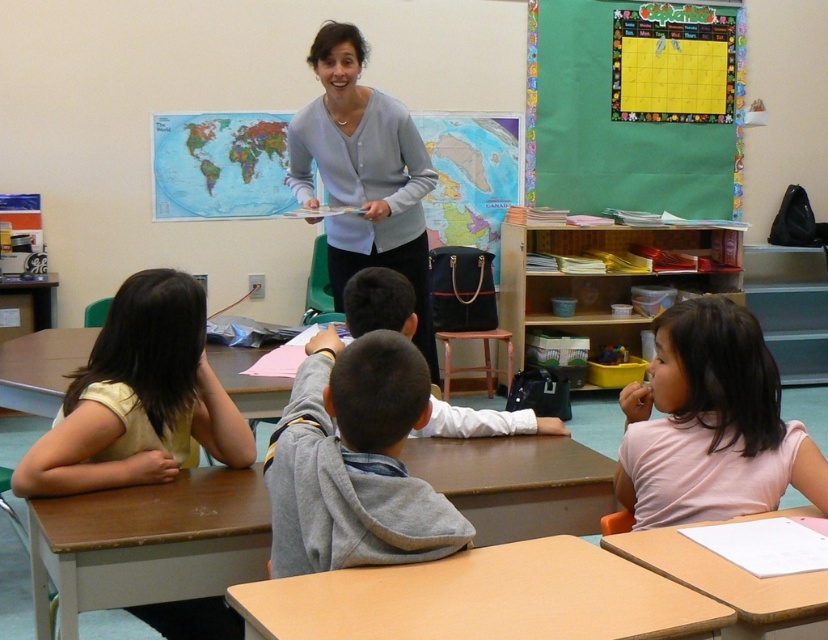
You are a student in the classroom and need to place a textbook on the light brown wooden table at center. However, you notice the white cotton shirt at center might be in the way. Can you place the textbook on the table without moving the shirt?

The light brown wooden table at center is shorter than the white cotton shirt at center. Since the table is shorter, the shirt might be blocking access to the table, making it difficult to place the textbook without moving the shirt.

You are a student sitting in the classroom and want to point out a location on the world map. If you have to choose between pointing at point [283,515] and point [696,516], which one would require you to reach closer to your desk?

Point [283,515] is closer to the viewer than point [696,516], so pointing at point [283,515] would require reaching closer to your desk.